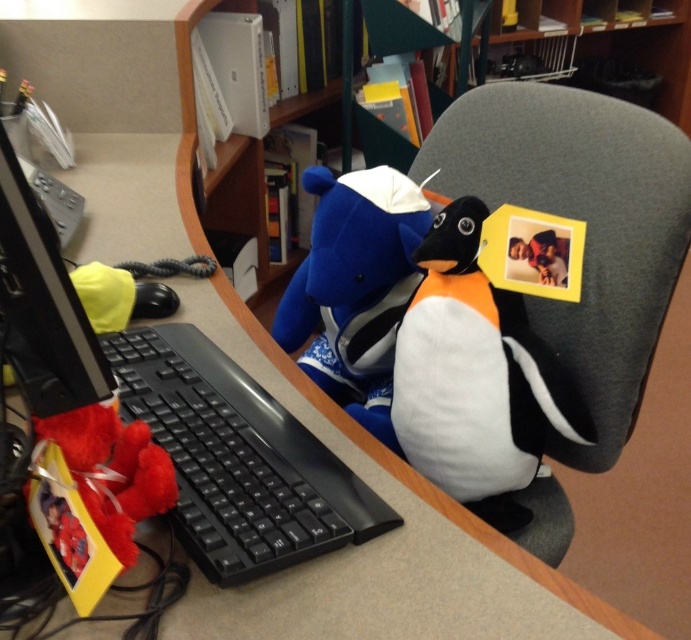
Who is positioned more to the right, white fabric swivel chair at right or blue plush bear at center?

From the viewer's perspective, white fabric swivel chair at right appears more on the right side.

The height and width of the screenshot is (640, 691). Describe the element at coordinates (586, 227) in the screenshot. I see `white fabric swivel chair at right` at that location.

Find the location of `white fabric swivel chair at right`. white fabric swivel chair at right is located at coordinates [586, 227].

Does white fabric swivel chair at right have a larger size compared to black plastic keyboard at lower left?

Yes, white fabric swivel chair at right is bigger than black plastic keyboard at lower left.

Who is more distant from viewer, (605, 392) or (334, 524)?

The point (605, 392) is more distant.

At what (x,y) coordinates should I click in order to perform the action: click on white fabric swivel chair at right. Please return your answer as a coordinate pair (x, y). This screenshot has height=640, width=691. Looking at the image, I should click on (586, 227).

Can you confirm if black plastic keyboard at lower left is smaller than blue plush bear at center?

Yes, black plastic keyboard at lower left is smaller than blue plush bear at center.

Is black plastic keyboard at lower left below blue plush bear at center?

Yes.

Which is in front, point (211, 476) or point (348, 276)?

Point (211, 476) is more forward.

This screenshot has width=691, height=640. Identify the location of black plastic keyboard at lower left. (238, 460).